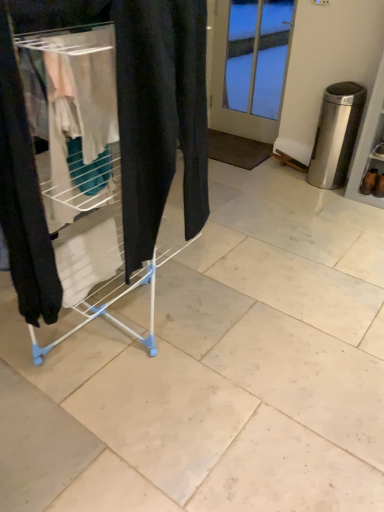
Question: Is brown suede boot at lower right, the 1th footwear viewed from the right, facing away from satin silver trash can at right?

Choices:
 (A) yes
 (B) no

Answer: (B)

Question: Is the surface of brown suede boot at lower right, the 1th footwear viewed from the right, in direct contact with satin silver trash can at right?

Choices:
 (A) yes
 (B) no

Answer: (B)

Question: Is brown suede boot at lower right, the second footwear positioned from the left, further to camera compared to satin silver trash can at right?

Choices:
 (A) yes
 (B) no

Answer: (A)

Question: From a real-world perspective, does brown suede boot at lower right, the 1th footwear viewed from the right, sit lower than satin silver trash can at right?

Choices:
 (A) no
 (B) yes

Answer: (B)

Question: From a real-world perspective, does brown suede boot at lower right, the second footwear positioned from the left, stand above satin silver trash can at right?

Choices:
 (A) no
 (B) yes

Answer: (A)

Question: From the image's perspective, relative to satin silver trash can at right, is white plastic drying rack at left above or below?

Choices:
 (A) above
 (B) below

Answer: (B)

Question: Do you think white plastic drying rack at left is within satin silver trash can at right, or outside of it?

Choices:
 (A) outside
 (B) inside

Answer: (A)

Question: Considering the positions of white plastic drying rack at left and satin silver trash can at right in the image, is white plastic drying rack at left wider or thinner than satin silver trash can at right?

Choices:
 (A) wide
 (B) thin

Answer: (A)

Question: From their relative heights in the image, would you say white plastic drying rack at left is taller or shorter than satin silver trash can at right?

Choices:
 (A) short
 (B) tall

Answer: (B)

Question: Considering the positions of point (314, 159) and point (196, 76), is point (314, 159) closer or farther from the camera than point (196, 76)?

Choices:
 (A) closer
 (B) farther

Answer: (B)

Question: From a real-world perspective, is satin silver trash can at right physically located above or below white plastic drying rack at left?

Choices:
 (A) below
 (B) above

Answer: (A)

Question: From the image's perspective, is satin silver trash can at right located above or below white plastic drying rack at left?

Choices:
 (A) above
 (B) below

Answer: (A)

Question: Considering the positions of satin silver trash can at right and white plastic drying rack at left in the image, is satin silver trash can at right wider or thinner than white plastic drying rack at left?

Choices:
 (A) thin
 (B) wide

Answer: (A)

Question: In the image, is satin silver trash can at right on the left side or the right side of white glass door at upper center?

Choices:
 (A) left
 (B) right

Answer: (B)

Question: Considering their positions, is satin silver trash can at right located in front of or behind white glass door at upper center?

Choices:
 (A) front
 (B) behind

Answer: (A)